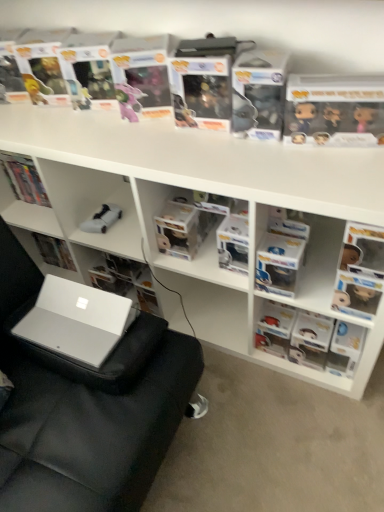
At what (x,y) coordinates should I click in order to perform the action: click on free space in front of clear plastic book at upper center, placed as the first paperback book when sorted from left to right. Please return your answer as a coordinate pair (x, y). The height and width of the screenshot is (512, 384). Looking at the image, I should click on (216, 150).